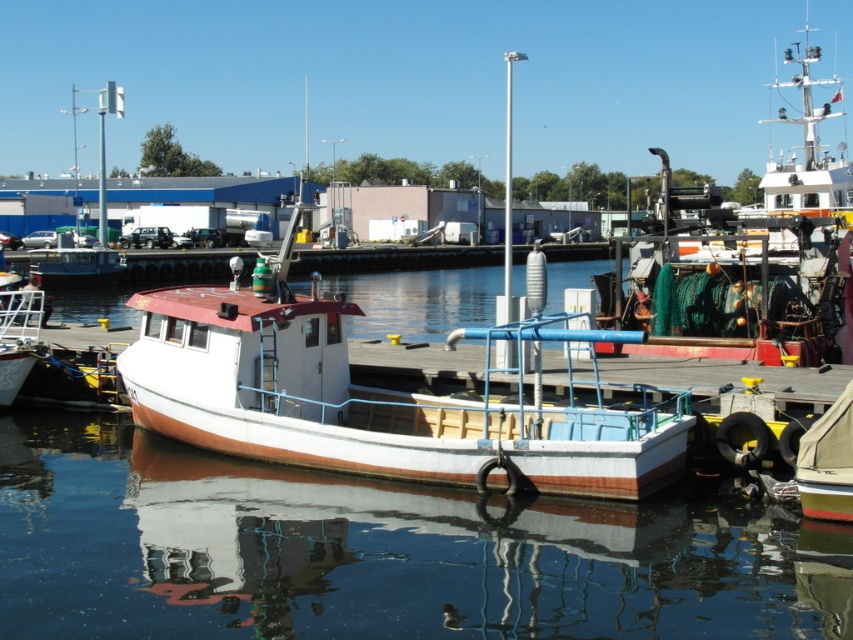
Can you confirm if transparent water at center is positioned above yellow rubber dinghy at lower right?

No, transparent water at center is not above yellow rubber dinghy at lower right.

Is point (126, 428) closer to viewer compared to point (799, 467)?

No.

The image size is (853, 640). Find the location of `transparent water at center`. transparent water at center is located at coordinates (379, 552).

Locate an element on the screen. The image size is (853, 640). transparent water at center is located at coordinates (379, 552).

Between white painted wood boat at center and yellow rubber dinghy at lower right, which one is positioned higher?

white painted wood boat at center is above.

Who is positioned more to the right, white painted wood boat at center or yellow rubber dinghy at lower right?

yellow rubber dinghy at lower right is more to the right.

Does point (209, 372) come closer to viewer compared to point (851, 486)?

No.

Find the location of a particular element. white painted wood boat at center is located at coordinates (380, 401).

Does transparent water at center have a smaller size compared to white painted wood boat at center?

Yes.

Can you confirm if transparent water at center is wider than white painted wood boat at center?

Correct, the width of transparent water at center exceeds that of white painted wood boat at center.

Does point (585, 522) come farther from viewer compared to point (260, 451)?

That is False.

You are a GUI agent. You are given a task and a screenshot of the screen. Output one action in this format:
    pyautogui.click(x=<x>, y=<y>)
    Task: Click on the transparent water at center
    
    Given the screenshot: What is the action you would take?
    pyautogui.click(x=379, y=552)